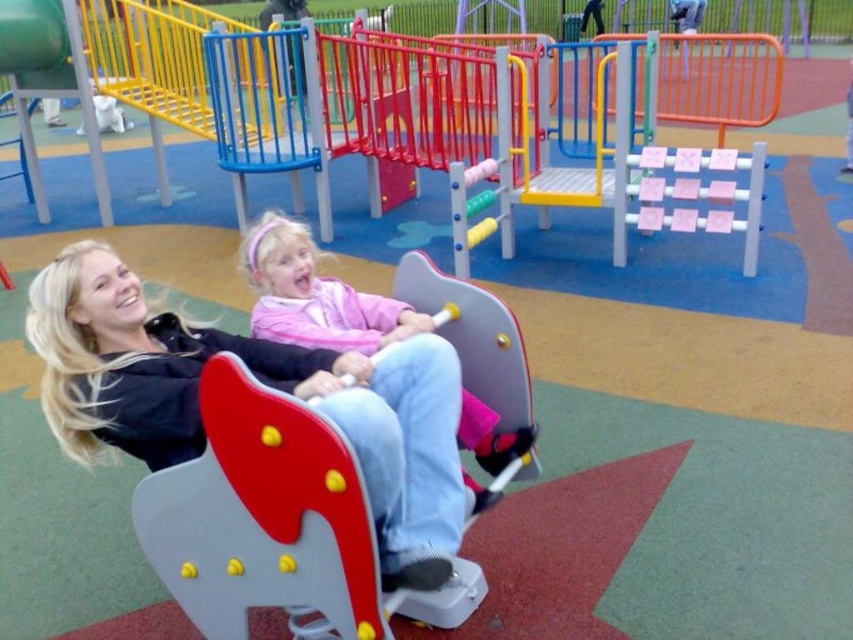
You are a photographer standing at the playground and want to take a photo of the matte black jacket at center and the pink matte shirt at center. Which object will appear larger in the photo?

The matte black jacket at center will appear larger in the photo because it is closer to the viewer than the pink matte shirt at center.

You are standing at the center of the playground and want to find the matte black jacket at center. According to the coordinates provided, where should you look relative to the center of the image?

The matte black jacket at center is located at the coordinates point [260,381], which means it is slightly to the right and slightly below the center of the image.

You are standing at the center of the playground and see the matte black jacket at center and the pink matte shirt at center. Which one is positioned to the left?

The matte black jacket at center is to the left of the pink matte shirt at center.